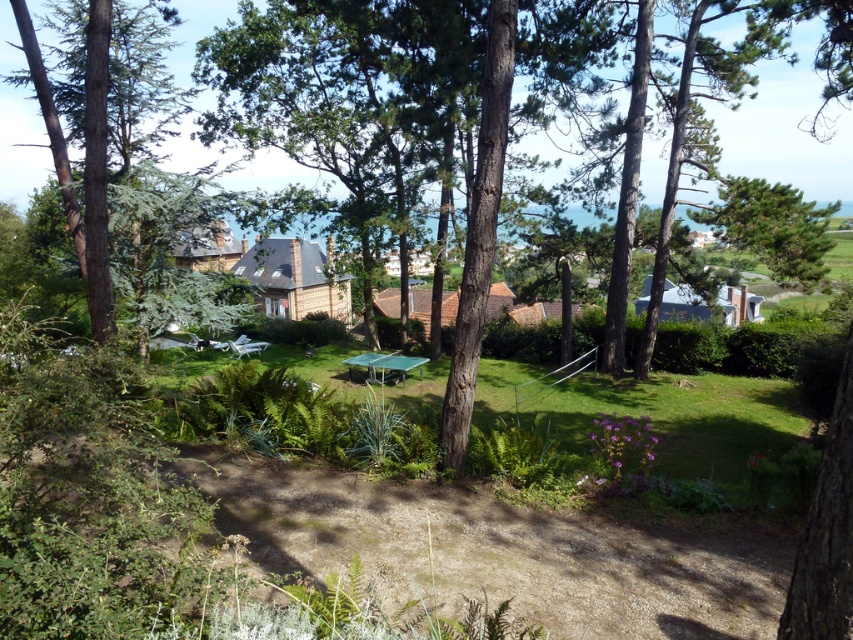
You are standing in the garden and want to place a small decorative statue. The statue requires a flat surface at the center of the garden. Is the green grass at center suitable for placing the statue?

The green grass at center is located at point (643, 440), which is the center of the garden. Since the grass is flat, it is suitable for placing the statue.

You are planning to set up a small garden in your backyard and have a green metallic picnic table at center and a green textured pine tree at upper right. Which object should you place closer to the left side of your garden to ensure proper spacing?

The green metallic picnic table at center should be placed closer to the left side of your garden because the green textured pine tree at upper right is positioned on the right side of it.